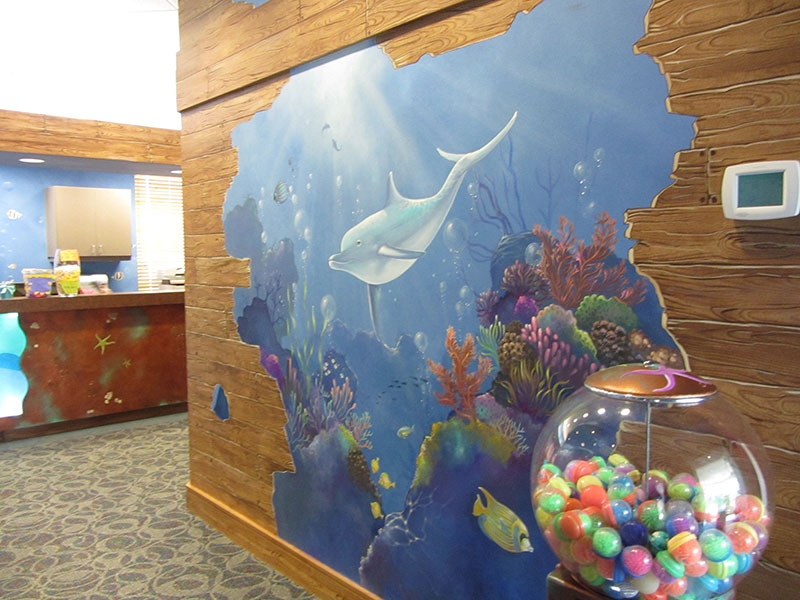
Locate an element on the screen. The width and height of the screenshot is (800, 600). book is located at coordinates (172, 279).